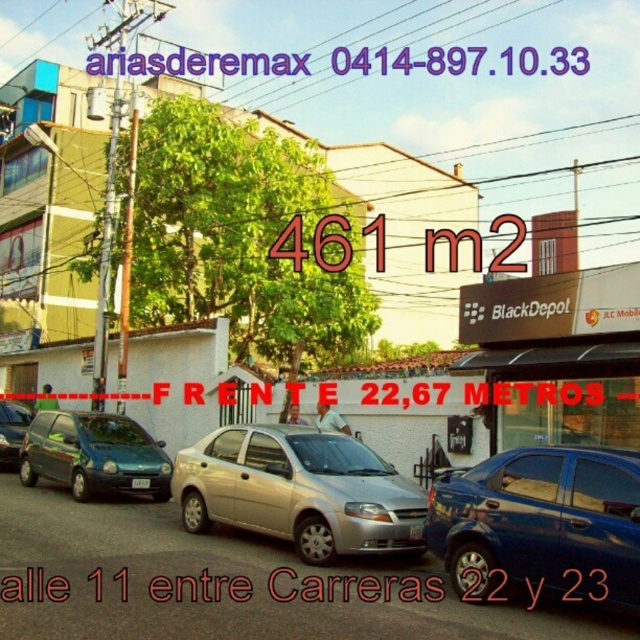
You are a delivery person trying to read a white matte signboard at center. There is a metallic green hatchback at left parked in front of it. Can you see the entire signboard?

The white matte signboard at center is taller than the metallic green hatchback at left, so yes, you can see the entire signboard.

You are a delivery person trying to park your van between the metallic green hatchback at left and the matte black sedan at left. Based on the scene, can you fit your van there?

The metallic green hatchback at left is to the right of the matte black sedan at left, so there is space between them. However, the scene shows three parked cars in the foreground, which might indicate limited space. Without exact measurements, it is uncertain if the van can fit.

You are standing at the center of the street and want to find the white matte signboard at center. Based on the coordinates provided, in which direction should you look to locate it?

The white matte signboard at center is located at coordinates point (556, 356), which means it is positioned slightly to the right and lower than the exact center of the image. Therefore, you should look towards the lower right direction from the center of the street to locate it.